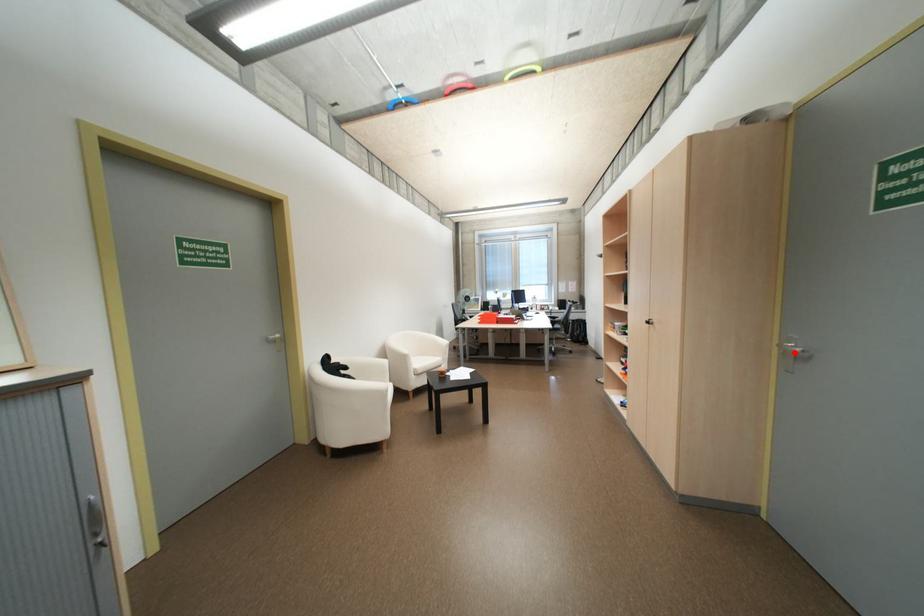
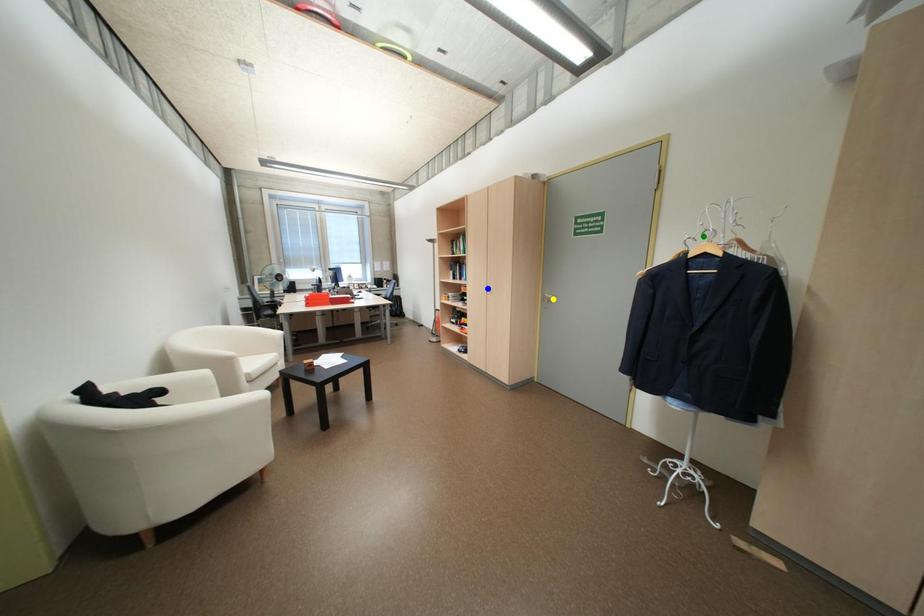
Question: I am providing you with two images of the same scene from different viewpoints. A red point is marked on the first image. You are given multiple points on the second image. Which point in image 2 is actually the same real-world point as the red point in image 1?

Choices:
 (A) blue point
 (B) yellow point
 (C) green point

Answer: (B)